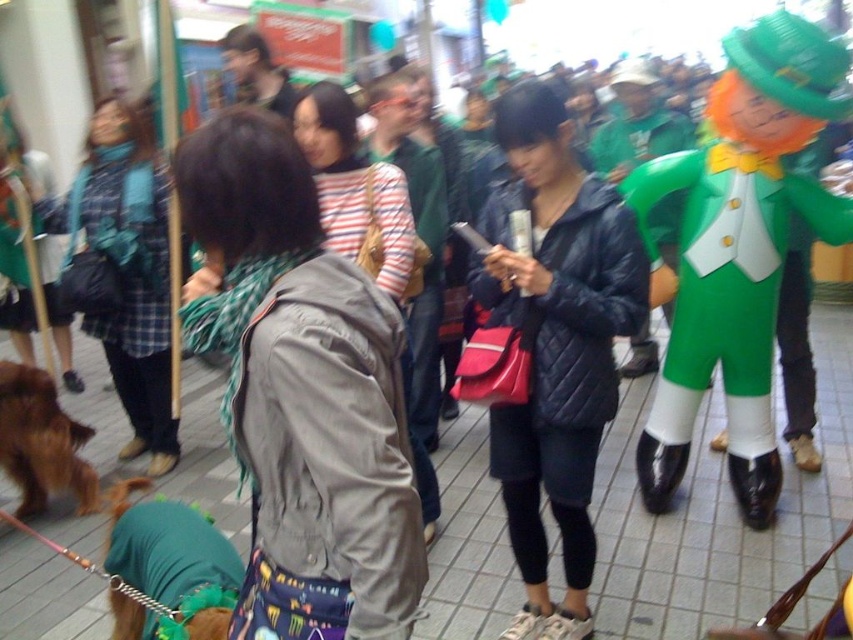
You are a photographer trying to capture a photo of both the matte black jacket at center and the green fabric costume at right. Which object should you focus on first to ensure both are in frame?

The matte black jacket at center is taller than the green fabric costume at right, so you should focus on the matte black jacket at center first to ensure both are in frame.

You are a photographer trying to capture a clear shot of the matte black jacket at center and the striped fabric at center. Since you want to focus on the taller object, which one should you adjust your camera to focus on?

The matte black jacket at center is taller than the striped fabric at center, so you should adjust your camera to focus on the matte black jacket at center.

You are a photographer trying to capture a photo of the green fabric costume at right without including the matte black jacket at center in the frame. Based on their positions, is this possible?

The matte black jacket at center is positioned on the left side of green fabric costume at right, so if you move to the right side of the green fabric costume at right, you can avoid including the matte black jacket at center in your photo.